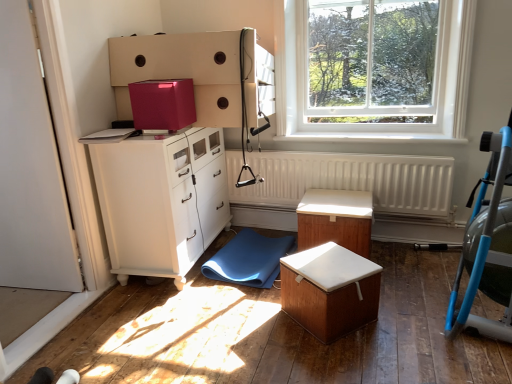
Identify the location of white matte radiator at center. The height and width of the screenshot is (384, 512). (347, 180).

This screenshot has width=512, height=384. Identify the location of clear glass window at upper right. (376, 80).

What do you see at coordinates (249, 259) in the screenshot?
I see `blue rubber mat at lower center` at bounding box center [249, 259].

In order to face white glossy cabinet at left, should I rotate leftwards or rightwards?

You should rotate left by 11.049 degrees.

The width and height of the screenshot is (512, 384). Find the location of `wooden table at center, the 2th table viewed from the front`. wooden table at center, the 2th table viewed from the front is located at coordinates (335, 219).

Is point (380, 179) in front of point (331, 337)?

No, (380, 179) is behind (331, 337).

You are a GUI agent. You are given a task and a screenshot of the screen. Output one action in this format:
    pyautogui.click(x=<x>, y=<y>)
    Task: Click on the radiator above the wooden box with white cushion at center, marked as the first table in a front-to-back arrangement (from the image's perspective)
    Image resolution: width=512 pixels, height=384 pixels.
    Given the screenshot: What is the action you would take?
    pyautogui.click(x=347, y=180)

From the image's perspective, relative to wooden box with white cushion at center, marked as the first table in a front-to-back arrangement, is white matte radiator at center above or below?

white matte radiator at center is above wooden box with white cushion at center, marked as the first table in a front-to-back arrangement.

Can you tell me how much white matte radiator at center and wooden box with white cushion at center, marked as the first table in a front-to-back arrangement, differ in facing direction?

39.7 degrees.

Would you say white glossy cabinet at left contains blue plastic baby carriage at right?

No, blue plastic baby carriage at right is located outside of white glossy cabinet at left.

From a real-world perspective, is white glossy cabinet at left on top of blue plastic baby carriage at right?

Actually, white glossy cabinet at left is physically below blue plastic baby carriage at right in the real world.

Looking at the image, does white glossy cabinet at left seem bigger or smaller compared to blue plastic baby carriage at right?

white glossy cabinet at left is bigger than blue plastic baby carriage at right.

Can you confirm if white glossy cabinet at left is shorter than wooden box with white cushion at center, marked as the second table in a back-to-front arrangement?

No, white glossy cabinet at left is not shorter than wooden box with white cushion at center, marked as the second table in a back-to-front arrangement.

Is white glossy cabinet at left in front of or behind wooden box with white cushion at center, marked as the second table in a back-to-front arrangement, in the image?

white glossy cabinet at left is behind wooden box with white cushion at center, marked as the second table in a back-to-front arrangement.

From a real-world perspective, starting from the white glossy cabinet at left, which table is the 2nd one below it? Please provide its 2D coordinates.

[(330, 290)]

How many degrees apart are the facing directions of white glossy cabinet at left and wooden box with white cushion at center, marked as the first table in a front-to-back arrangement?

They differ by 132 degrees in their facing directions.

Which of these two, wooden box with white cushion at center, marked as the first table in a front-to-back arrangement, or wooden table at center, acting as the 1th table starting from the back, is bigger?

wooden table at center, acting as the 1th table starting from the back.

Could wooden table at center, the 2th table viewed from the front, be considered to be inside wooden box with white cushion at center, marked as the second table in a back-to-front arrangement?

That's incorrect, wooden table at center, the 2th table viewed from the front, is not inside wooden box with white cushion at center, marked as the second table in a back-to-front arrangement.

Could you tell me if wooden box with white cushion at center, marked as the second table in a back-to-front arrangement, is facing wooden table at center, the 2th table viewed from the front?

No, wooden box with white cushion at center, marked as the second table in a back-to-front arrangement, does not turn towards wooden table at center, the 2th table viewed from the front.

Is wooden box with white cushion at center, marked as the second table in a back-to-front arrangement, thinner than wooden table at center, the 2th table viewed from the front?

Yes.

From a real-world perspective, is wooden box with white cushion at center, marked as the first table in a front-to-back arrangement, on top of blue rubber mat at lower center?

Correct, in the physical world, wooden box with white cushion at center, marked as the first table in a front-to-back arrangement, is higher than blue rubber mat at lower center.

I want to click on swivel chair located on the left of wooden box with white cushion at center, marked as the first table in a front-to-back arrangement, so click(x=249, y=259).

Which of these two, wooden box with white cushion at center, marked as the first table in a front-to-back arrangement, or blue rubber mat at lower center, is smaller?

blue rubber mat at lower center.

Does wooden box with white cushion at center, marked as the second table in a back-to-front arrangement, have a lesser height compared to blue rubber mat at lower center?

Incorrect, the height of wooden box with white cushion at center, marked as the second table in a back-to-front arrangement, does not fall short of that of blue rubber mat at lower center.

The height and width of the screenshot is (384, 512). What are the coordinates of `baby carriage on the right of wooden table at center, the 2th table viewed from the front` in the screenshot? It's located at (488, 245).

In the scene shown: From the image's perspective, is blue plastic baby carriage at right on top of wooden table at center, acting as the 1th table starting from the back?

Yes, from the image's perspective, blue plastic baby carriage at right is over wooden table at center, acting as the 1th table starting from the back.

Are blue plastic baby carriage at right and wooden table at center, acting as the 1th table starting from the back, far apart?

Actually, blue plastic baby carriage at right and wooden table at center, acting as the 1th table starting from the back, are a little close together.

Based on the photo, is blue rubber mat at lower center smaller than white matte radiator at center?

Yes, blue rubber mat at lower center is smaller than white matte radiator at center.

From a real-world perspective, is blue rubber mat at lower center positioned over white matte radiator at center based on gravity?

No.

The height and width of the screenshot is (384, 512). Find the location of `radiator above the blue rubber mat at lower center (from a real-world perspective)`. radiator above the blue rubber mat at lower center (from a real-world perspective) is located at coordinates (347, 180).

Who is taller, blue rubber mat at lower center or white matte radiator at center?

white matte radiator at center.

You are a GUI agent. You are given a task and a screenshot of the screen. Output one action in this format:
    pyautogui.click(x=<x>, y=<y>)
    Task: Click on the table that is the 2nd object to the left of the white matte radiator at center, starting at the anchor
    The height and width of the screenshot is (384, 512).
    Given the screenshot: What is the action you would take?
    pyautogui.click(x=330, y=290)

Locate an element on the screen. chest of drawers above the blue plastic baby carriage at right (from the image's perspective) is located at coordinates (161, 201).

Looking at the image, which one is located closer to clear glass window at upper right, white matte radiator at center or white glossy cabinet at left?

The object closer to clear glass window at upper right is white matte radiator at center.

When comparing their distances from clear glass window at upper right, does blue rubber mat at lower center or wooden table at center, the 2th table viewed from the front, seem closer?

wooden table at center, the 2th table viewed from the front, lies closer to clear glass window at upper right than the other object.

Considering their positions, is wooden box with white cushion at center, marked as the second table in a back-to-front arrangement, positioned closer to clear glass window at upper right than white matte radiator at center?

The object closer to clear glass window at upper right is white matte radiator at center.

Estimate the real-world distances between objects in this image. Which object is further from wooden table at center, acting as the 1th table starting from the back, white matte radiator at center or blue plastic baby carriage at right?

Based on the image, blue plastic baby carriage at right appears to be further to wooden table at center, acting as the 1th table starting from the back.

Based on their spatial positions, is wooden table at center, acting as the 1th table starting from the back, or clear glass window at upper right further from blue plastic baby carriage at right?

clear glass window at upper right.

When comparing their distances from white matte radiator at center, does blue plastic baby carriage at right or white glossy cabinet at left seem further?

The object further to white matte radiator at center is blue plastic baby carriage at right.

Which object lies further to the anchor point clear glass window at upper right, white matte radiator at center or blue plastic baby carriage at right?

The object further to clear glass window at upper right is blue plastic baby carriage at right.

Estimate the real-world distances between objects in this image. Which object is closer to wooden table at center, acting as the 1th table starting from the back, white glossy cabinet at left or wooden box with white cushion at center, marked as the second table in a back-to-front arrangement?

wooden box with white cushion at center, marked as the second table in a back-to-front arrangement, is closer to wooden table at center, acting as the 1th table starting from the back.

The height and width of the screenshot is (384, 512). I want to click on swivel chair between blue plastic baby carriage at right and white matte radiator at center along the z-axis, so click(249, 259).

I want to click on radiator situated between white glossy cabinet at left and clear glass window at upper right from left to right, so click(x=347, y=180).

Where is `radiator between clear glass window at upper right and blue rubber mat at lower center from top to bottom`? The width and height of the screenshot is (512, 384). radiator between clear glass window at upper right and blue rubber mat at lower center from top to bottom is located at coordinates (347, 180).

Image resolution: width=512 pixels, height=384 pixels. I want to click on swivel chair between white glossy cabinet at left and white matte radiator at center in the horizontal direction, so click(x=249, y=259).